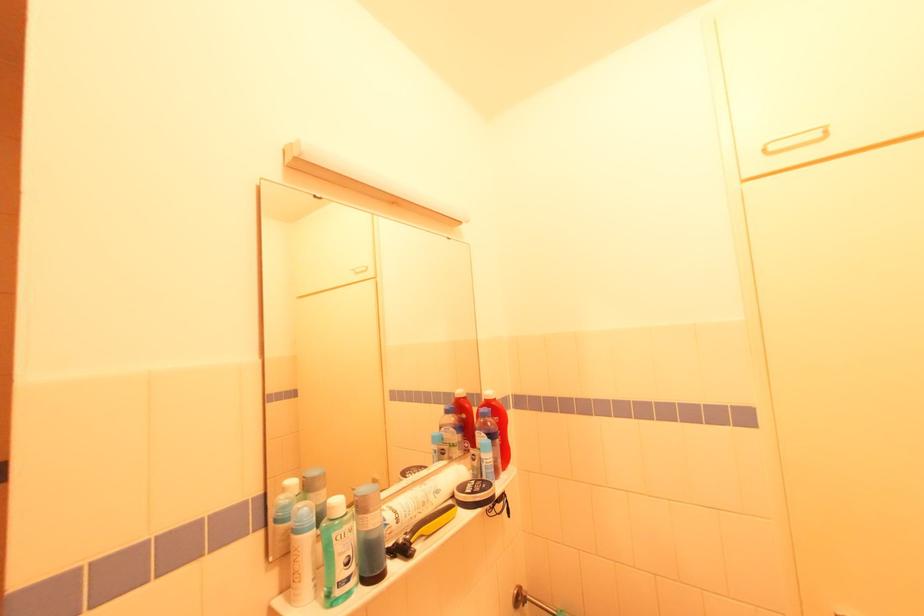
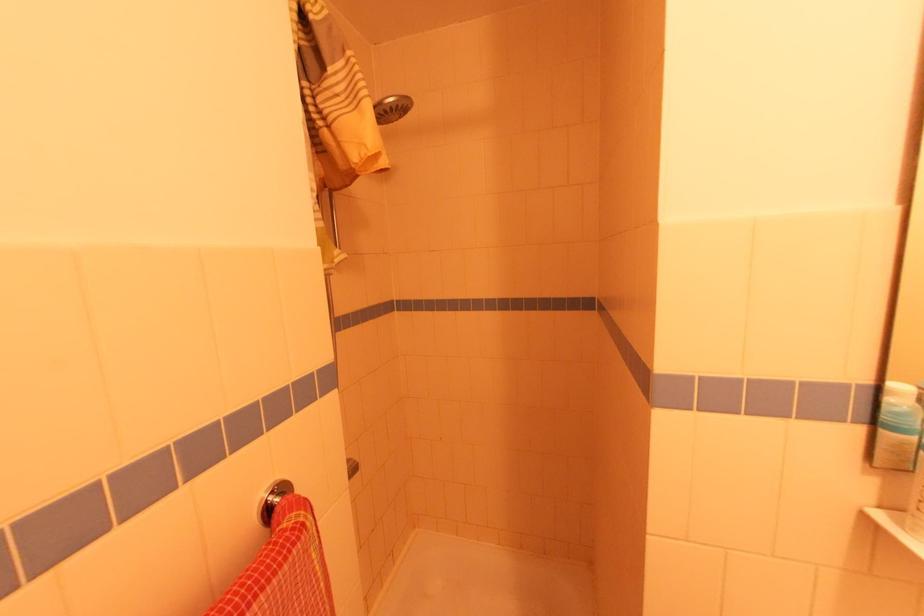
Question: Based on the continuous images, in which direction is the camera rotating? Reply with the corresponding letter.

Choices:
 (A) Left
 (B) Right
 (C) Up
 (D) Down

Answer: (A)